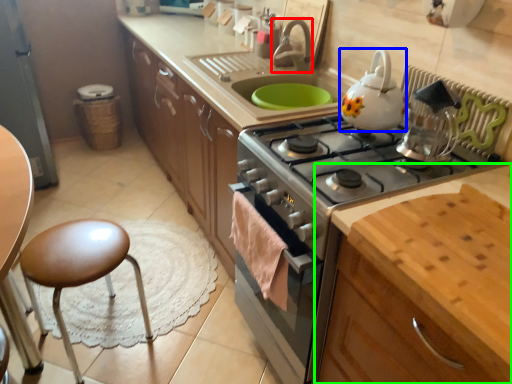
Question: Based on their relative distances, which object is farther from faucet (highlighted by a red box)? Choose from kitchen appliance (highlighted by a blue box) and cabinetry (highlighted by a green box).

Choices:
 (A) kitchen appliance
 (B) cabinetry

Answer: (B)